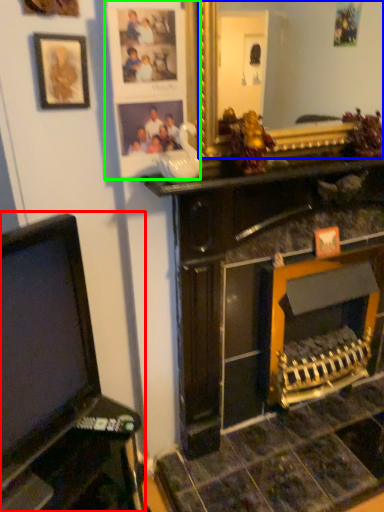
Question: Estimate the real-world distances between objects in this image. Which object is closer to furniture (highlighted by a red box), mirror (highlighted by a blue box) or picture frame (highlighted by a green box)?

Choices:
 (A) mirror
 (B) picture frame

Answer: (B)